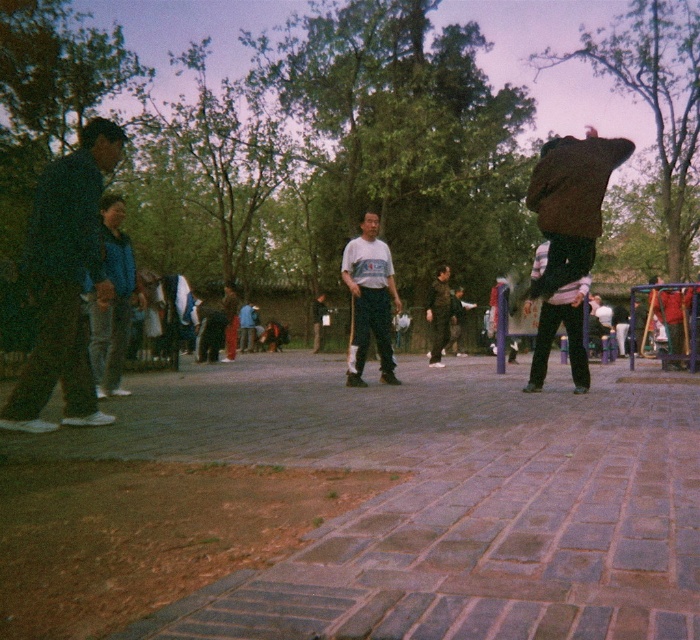
You are a photographer positioned at the center of the paved area. You want to capture a photo that includes both the dark blue suit at left and the dark brown leather jacket at right. Based on their positions, which direction should you move to ensure both subjects are in the frame?

Since the dark blue suit at left is to the left of the dark brown leather jacket at right, you should move to the left to include both subjects in the frame.

You are planning to take a photo of the dark blue suit at left and the white matte shirt at center in the park scene. Which of the two should you focus on first if you want to capture both clearly in your shot?

The dark blue suit at left should be focused on first because it has a larger size compared to the white matte shirt at center, making it more prominent in the frame.